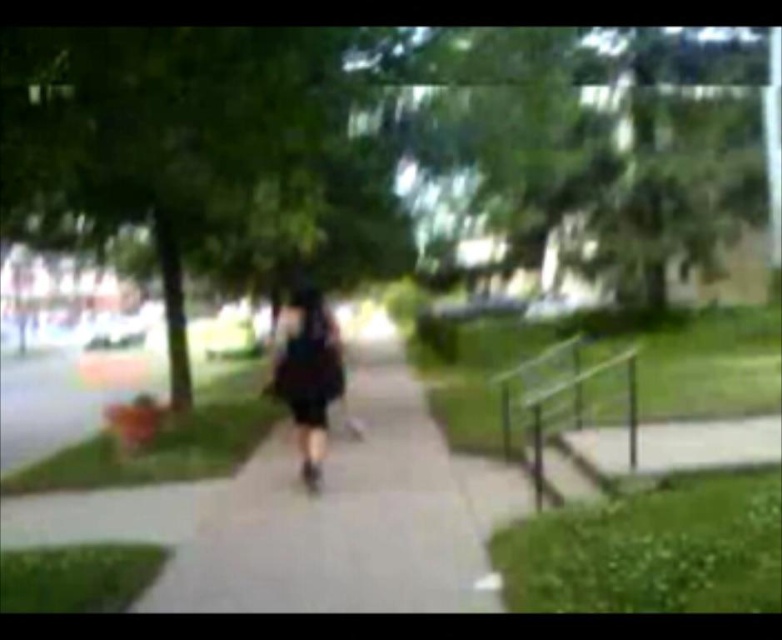
From the picture: How far apart are gray concrete sidewalk at center and black matte dress at center?

gray concrete sidewalk at center and black matte dress at center are 1.96 meters apart.

Which is in front, point (271, 432) or point (287, 349)?

Point (287, 349)

Which is in front, point (339, 509) or point (287, 356)?

Point (339, 509) is more forward.

The width and height of the screenshot is (782, 640). In order to click on gray concrete sidewalk at center in this screenshot , I will do `click(339, 518)`.

Is point (255, 541) positioned after point (633, 397)?

No, it is in front of (633, 397).

What do you see at coordinates (339, 518) in the screenshot? The width and height of the screenshot is (782, 640). I see `gray concrete sidewalk at center` at bounding box center [339, 518].

I want to click on gray concrete sidewalk at center, so click(339, 518).

Consider the image. Between black matte dress at center and green matte railing at lower right, which one appears on the right side from the viewer's perspective?

green matte railing at lower right

Between black matte dress at center and green matte railing at lower right, which one has more height?

With more height is green matte railing at lower right.

Describe the element at coordinates (307, 362) in the screenshot. This screenshot has height=640, width=782. I see `black matte dress at center` at that location.

I want to click on black matte dress at center, so click(307, 362).